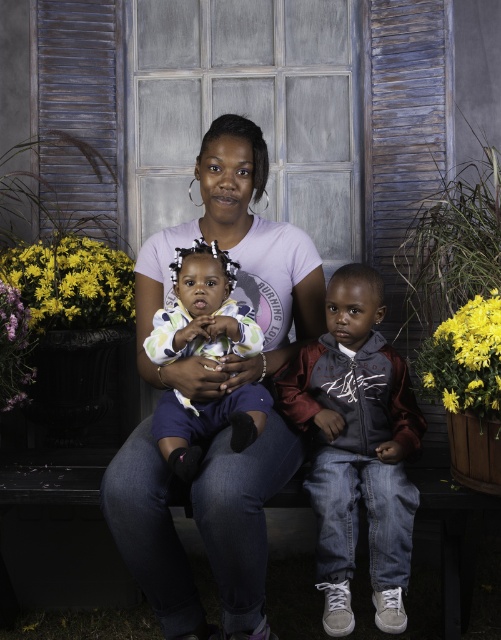
Which is in front, point (189, 419) or point (132, 262)?

Point (189, 419) is in front.

Who is more distant from viewer, (182, 337) or (132, 314)?

Point (132, 314)

I want to click on soft pastel onesie at center, so point(202,308).

What do you see at coordinates (357, 448) in the screenshot? This screenshot has width=501, height=640. I see `velvet maroon hoodie at center` at bounding box center [357, 448].

Which is above, velvet maroon hoodie at center or soft pastel onesie at center?

soft pastel onesie at center

This screenshot has height=640, width=501. In order to click on velvet maroon hoodie at center in this screenshot , I will do `click(357, 448)`.

Who is more forward, (389,532) or (33,284)?

Point (389,532)

Which is more to the left, velvet maroon hoodie at center or yellow matte flowers at left?

From the viewer's perspective, yellow matte flowers at left appears more on the left side.

Is point (377, 300) positioned in front of point (53, 321)?

Yes, point (377, 300) is in front of point (53, 321).

This screenshot has width=501, height=640. I want to click on velvet maroon hoodie at center, so click(x=357, y=448).